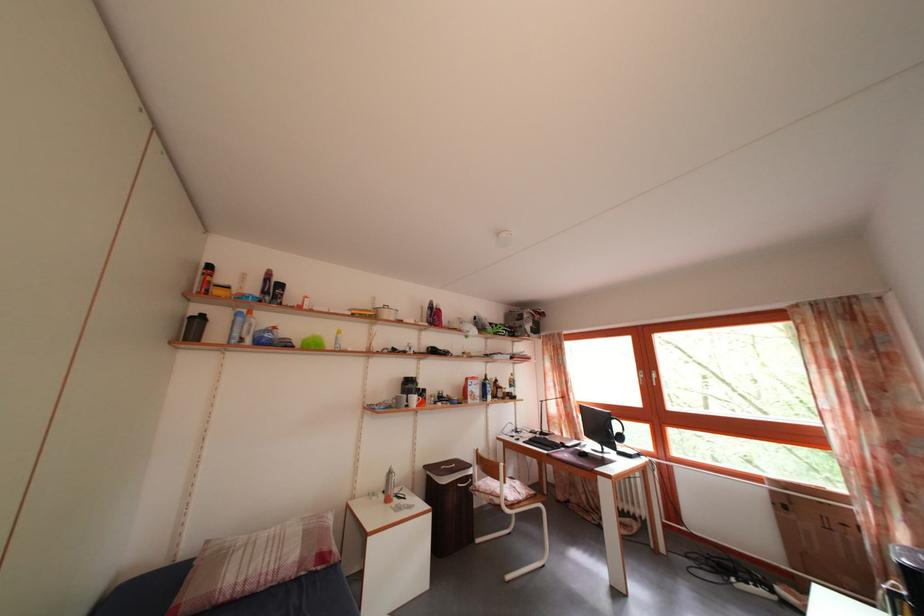
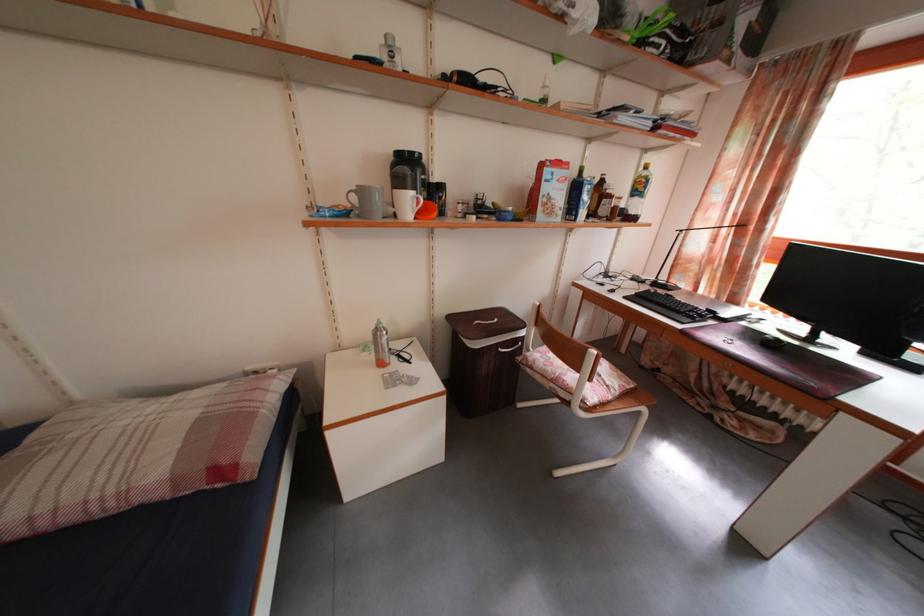
The point at (x=397, y=480) is marked in the first image. Where is the corresponding point in the second image?

(384, 338)